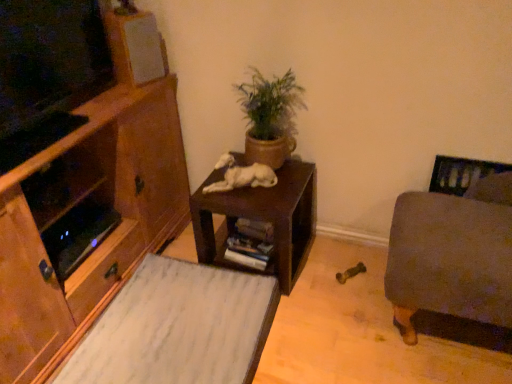
Where is `free space between dark brown wood table at center and velvet gray ottoman at right`? free space between dark brown wood table at center and velvet gray ottoman at right is located at coordinates (336, 284).